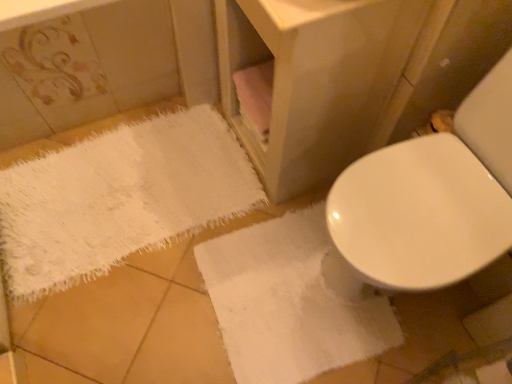
Image resolution: width=512 pixels, height=384 pixels. Find the location of `vacant space that is to the left of white fluffy bath towel at lower right, the first bath towel positioned from the right`. vacant space that is to the left of white fluffy bath towel at lower right, the first bath towel positioned from the right is located at coordinates (147, 319).